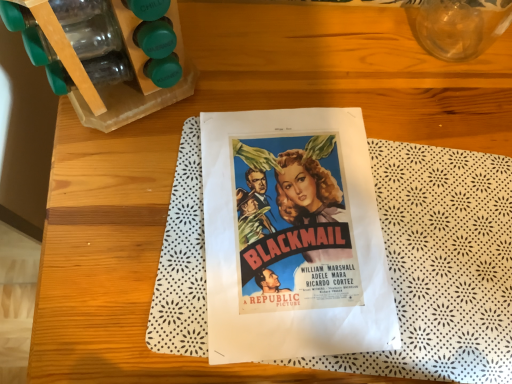
Identify the location of free location in front of transparent glass vase at upper right. Image resolution: width=512 pixels, height=384 pixels. (426, 136).